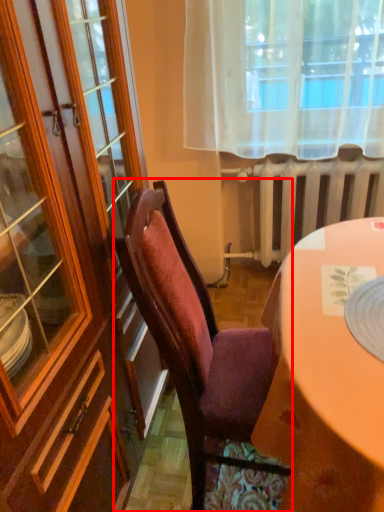
Question: From the image's perspective, what is the correct spatial positioning of chair (annotated by the red box) in reference to radiator?

Choices:
 (A) above
 (B) below

Answer: (B)